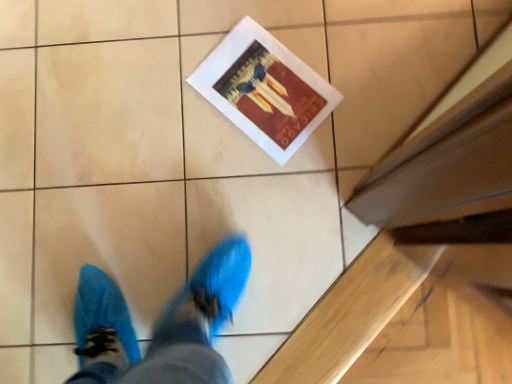
Identify the location of free location to the left of matte paper postcard at center. The width and height of the screenshot is (512, 384). (174, 118).